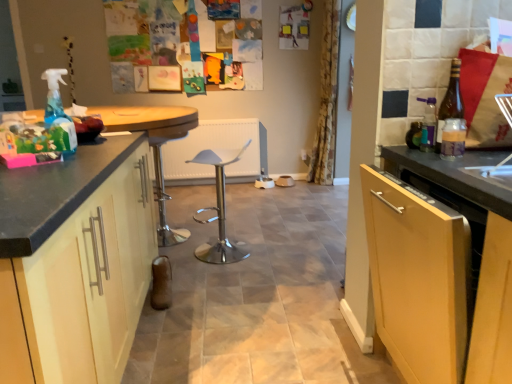
You are a GUI agent. You are given a task and a screenshot of the screen. Output one action in this format:
    pyautogui.click(x=<x>, y=<y>)
    Task: Click on the free space to the left of polished silver bar stool at center, acting as the 2th bar stool starting from the left
    
    Given the screenshot: What is the action you would take?
    pyautogui.click(x=183, y=253)